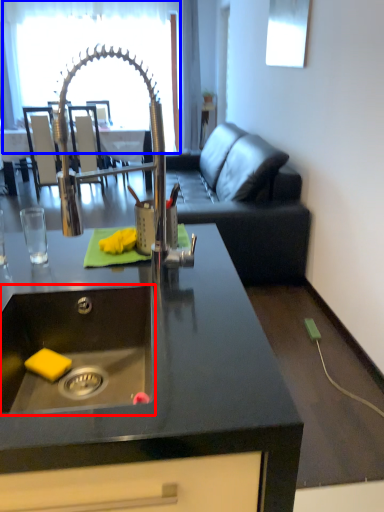
Question: Among these objects, which one is nearest to the camera, sink (highlighted by a red box) or glass door (highlighted by a blue box)?

Choices:
 (A) sink
 (B) glass door

Answer: (A)